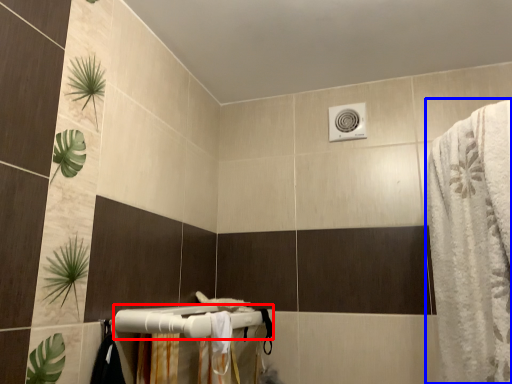
Question: Which point is closer to the camera, towel bar (highlighted by a red box) or bath towel (highlighted by a blue box)?

Choices:
 (A) towel bar
 (B) bath towel

Answer: (B)